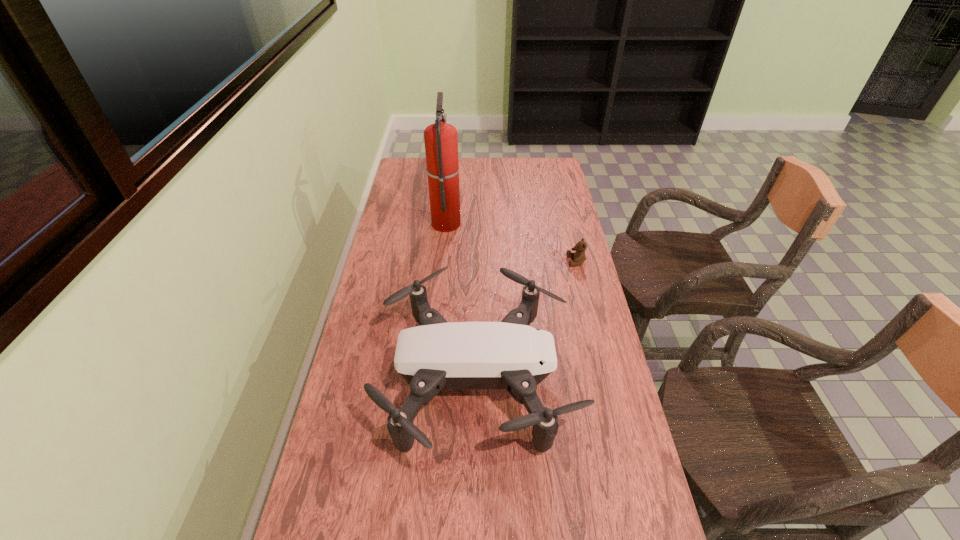
Identify the location of vacant space located 0.220m on the front-facing side of the second nearest object. (506, 261).

Identify the location of object present at the left edge. (511, 355).

This screenshot has height=540, width=960. I want to click on drone present at the right edge, so click(511, 355).

You are a GUI agent. You are given a task and a screenshot of the screen. Output one action in this format:
    pyautogui.click(x=<x>, y=<y>)
    Task: Click on the teddy bear that is at the right edge
    The width and height of the screenshot is (960, 540).
    Given the screenshot: What is the action you would take?
    pyautogui.click(x=579, y=257)

Locate an element on the screen. vacant position at the far edge of the desktop is located at coordinates (467, 183).

Locate an element on the screen. This screenshot has width=960, height=540. vacant space at the left edge of the desktop is located at coordinates (360, 380).

Locate an element on the screen. The width and height of the screenshot is (960, 540). vacant region at the right edge is located at coordinates (602, 317).

The height and width of the screenshot is (540, 960). Find the location of `free region at the far left corner of the desktop`. free region at the far left corner of the desktop is located at coordinates (424, 180).

The image size is (960, 540). I want to click on empty location between the second nearest object and the tallest object, so click(x=512, y=242).

Where is `unoccupied area between the farthest object and the second farthest object`? Image resolution: width=960 pixels, height=540 pixels. unoccupied area between the farthest object and the second farthest object is located at coordinates (512, 242).